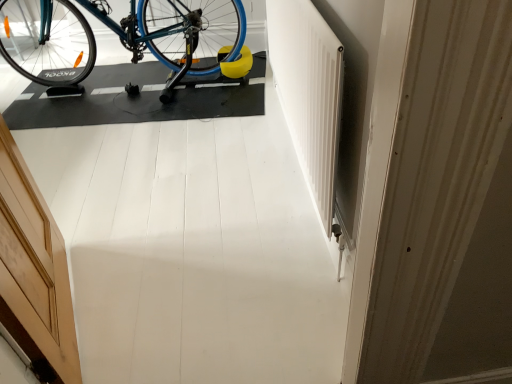
Locate an element on the screen. wooden door at left is located at coordinates (34, 269).

What do you see at coordinates (34, 269) in the screenshot? I see `wooden door at left` at bounding box center [34, 269].

What do you see at coordinates (179, 31) in the screenshot?
I see `blue metallic bicycle at upper left` at bounding box center [179, 31].

At what (x,y) coordinates should I click in order to perform the action: click on blue metallic bicycle at upper left. Please return your answer as a coordinate pair (x, y). Looking at the image, I should click on (179, 31).

Identify the location of wooden door at left. [34, 269].

Is blue metallic bicycle at upper left to the left of wooden door at left from the viewer's perspective?

Correct, you'll find blue metallic bicycle at upper left to the left of wooden door at left.

Is the position of blue metallic bicycle at upper left less distant than that of wooden door at left?

No, blue metallic bicycle at upper left is further to the viewer.

Is point (229, 14) less distant than point (8, 200)?

No, it is not.

From the image's perspective, which one is positioned higher, blue metallic bicycle at upper left or wooden door at left?

blue metallic bicycle at upper left.

From a real-world perspective, who is located lower, blue metallic bicycle at upper left or wooden door at left?

blue metallic bicycle at upper left.

Which of these two, blue metallic bicycle at upper left or wooden door at left, is wider?

blue metallic bicycle at upper left.

Who is shorter, blue metallic bicycle at upper left or wooden door at left?

Standing shorter between the two is blue metallic bicycle at upper left.

Looking at the image, does blue metallic bicycle at upper left seem bigger or smaller compared to wooden door at left?

Clearly, blue metallic bicycle at upper left is larger in size than wooden door at left.

Is wooden door at left surrounded by blue metallic bicycle at upper left?

Definitely not — wooden door at left is not inside blue metallic bicycle at upper left.

Is the surface of blue metallic bicycle at upper left in direct contact with wooden door at left?

No, blue metallic bicycle at upper left is not making contact with wooden door at left.

Is wooden door at left at the back of blue metallic bicycle at upper left?

No, blue metallic bicycle at upper left is not facing the opposite direction of wooden door at left.

Locate an element on the screen. The image size is (512, 384). bicycle on the left side of wooden door at left is located at coordinates (179, 31).

Considering the positions of objects wooden door at left and blue metallic bicycle at upper left in the image provided, who is more to the right, wooden door at left or blue metallic bicycle at upper left?

wooden door at left.

Which object is further away from the camera taking this photo, wooden door at left or blue metallic bicycle at upper left?

blue metallic bicycle at upper left is more distant.

Considering the points (32, 251) and (176, 35), which point is behind, point (32, 251) or point (176, 35)?

The point (176, 35) is farther.

From the image's perspective, which one is positioned higher, wooden door at left or blue metallic bicycle at upper left?

blue metallic bicycle at upper left is shown above in the image.

From a real-world perspective, is wooden door at left over blue metallic bicycle at upper left?

Yes, from a real-world perspective, wooden door at left is above blue metallic bicycle at upper left.

Does wooden door at left have a greater width compared to blue metallic bicycle at upper left?

In fact, wooden door at left might be narrower than blue metallic bicycle at upper left.

Considering the relative sizes of wooden door at left and blue metallic bicycle at upper left in the image provided, is wooden door at left shorter than blue metallic bicycle at upper left?

In fact, wooden door at left may be taller than blue metallic bicycle at upper left.

Looking at this image, can you confirm if wooden door at left is smaller than blue metallic bicycle at upper left?

Yes.

Is wooden door at left situated inside blue metallic bicycle at upper left or outside?

wooden door at left is spatially situated outside blue metallic bicycle at upper left.

In the scene shown: Are wooden door at left and blue metallic bicycle at upper left far apart?

That's right, there is a large distance between wooden door at left and blue metallic bicycle at upper left.

Is wooden door at left turned away from blue metallic bicycle at upper left?

wooden door at left is not turned away from blue metallic bicycle at upper left.

How many degrees apart are the facing directions of wooden door at left and blue metallic bicycle at upper left?

60.6 degrees.

Image resolution: width=512 pixels, height=384 pixels. In the image, there is a blue metallic bicycle at upper left. Identify the location of door below it (from the image's perspective). (34, 269).

What are the coordinates of `bicycle located behind the wooden door at left` in the screenshot? It's located at (179, 31).

The height and width of the screenshot is (384, 512). Identify the location of bicycle located underneath the wooden door at left (from a real-world perspective). (179, 31).